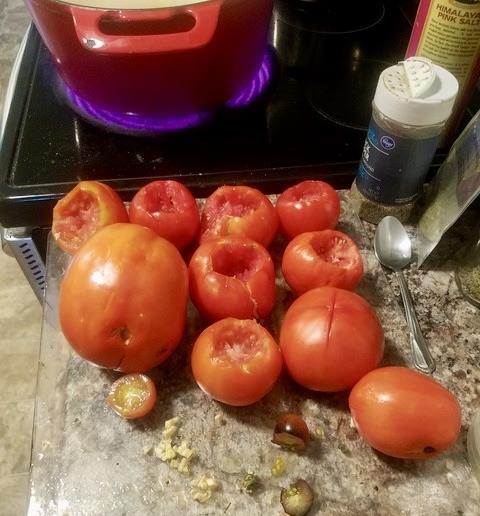
At what (x,y) coordinates should I click in order to perform the action: click on burner. Please return your answer as a coordinate pair (x, y). The image size is (480, 516). Looking at the image, I should click on (144, 117).